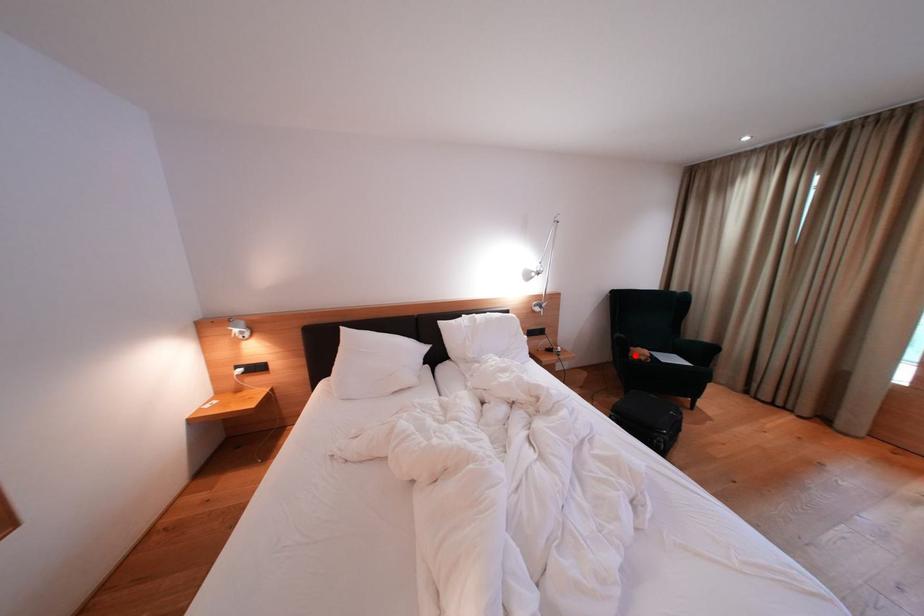
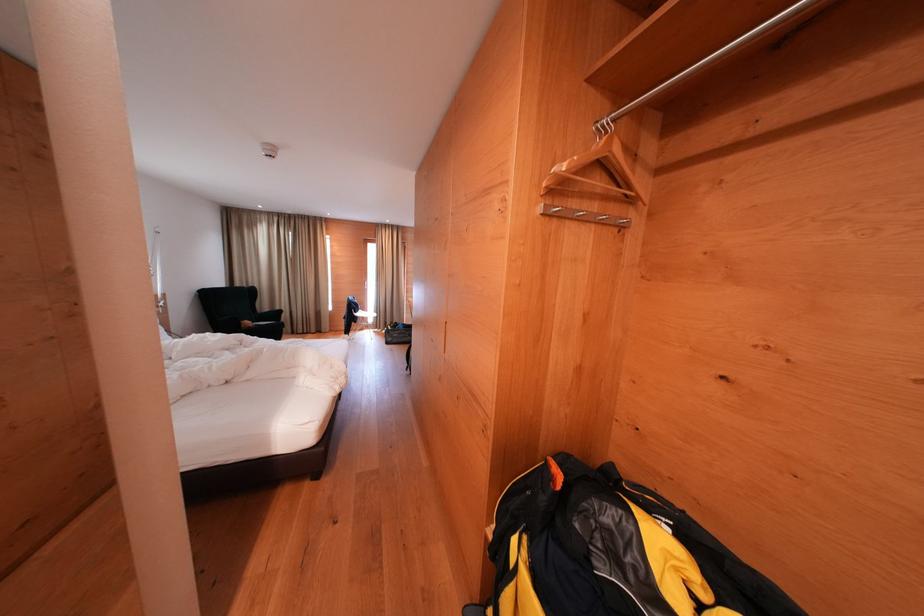
In the second image, find the point that corresponds to the highlighted location in the first image.

(247, 329)